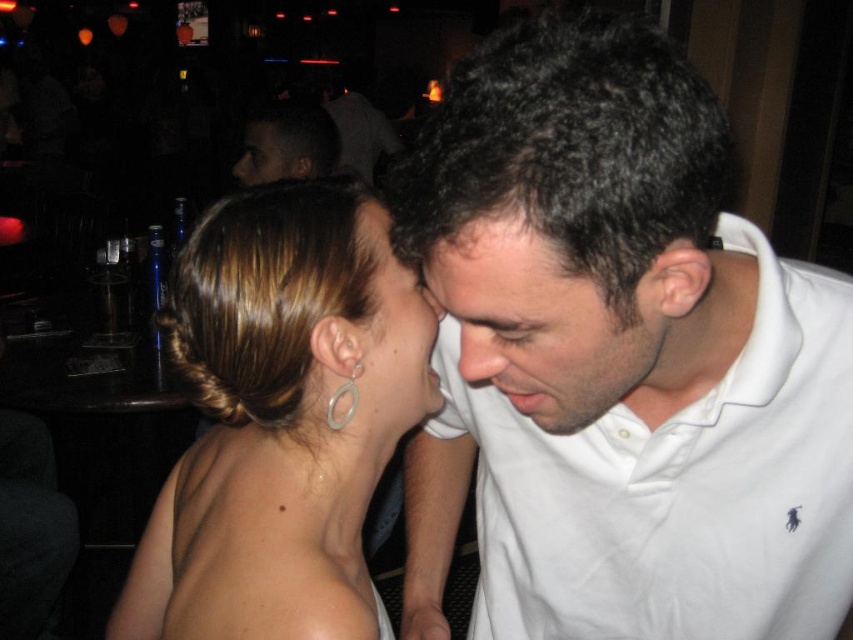
You are a photographer trying to capture a close shot of the white smooth shirt at center and the satin gold earring at center. Since you want to focus on both objects equally, which one should you adjust your camera focus to prioritize based on their positions?

The white smooth shirt at center is shorter than the satin gold earring at center, so to focus on both equally, prioritize focusing on the satin gold earring at center since it is farther away and requires a deeper focus.

You are a photographer trying to capture the perfect shot of the satin white dress at upper center. Based on the scene description, where should you position your camera to ensure the dress is in the center of the frame?

The satin white dress at upper center is located at point (280, 419), so you should position your camera to center the frame at those coordinates to capture the dress perfectly.

From the picture: You are a photographer who wants to ensure both the satin white dress at upper center and the matte black face at upper center are clearly visible in your photo. Given their current positions, which one might be more challenging to capture properly and why?

The matte black face at upper center might be more challenging to capture properly because it is positioned behind the satin white dress at upper center, which could block or obscure the face in the photo.